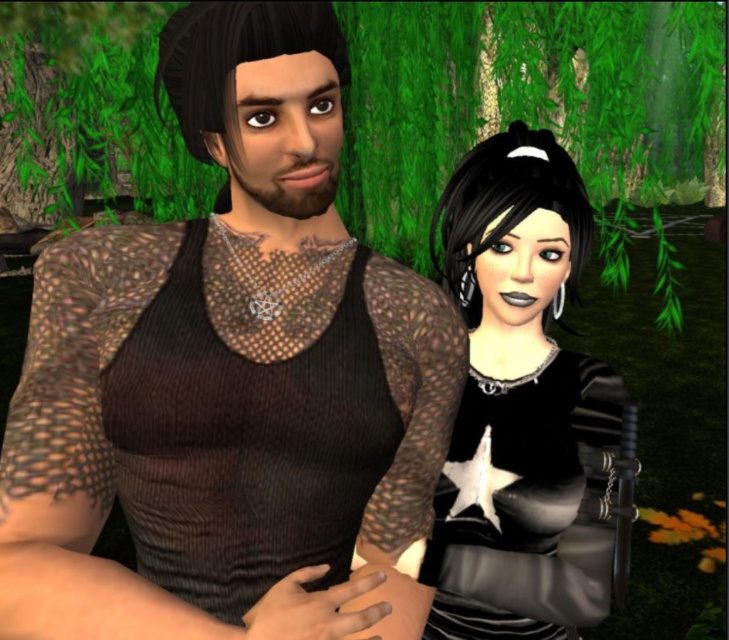
You are an AI analyzing a digital image. The scene shows two characters in a lush green outdoor setting with dense foliage. You need to determine the exact coordinates of the matte black mesh tank top at center. What are its coordinates?

The coordinates of the matte black mesh tank top at center are at point [227,376].

In the scene shown: You are a fashion designer observing the two outfits in the image. Which of the two items, the matte black mesh tank top at center or the black leather dress at right, would you choose to feature in a campaign focused on minimalist, understated elegance? Explain your choice based on their sizes as shown in the scene.

The matte black mesh tank top at center is smaller than the black leather dress at right. For a minimalist campaign emphasizing understated elegance, the matte black mesh tank top at center would be more appropriate due to its compact size, which aligns with the principle of simplicity and less is more.